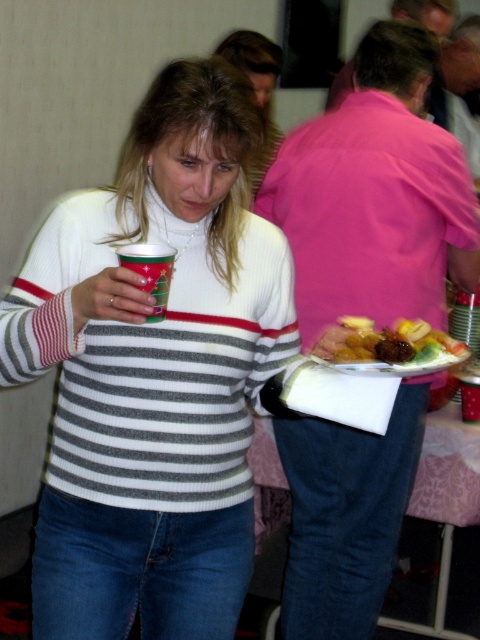
Based on the photo, you are a guest at the party and want to place your glossy plastic plate at lower center on the pink fabric table at lower center. Can you do so without needing to adjust your standing position?

The pink fabric table at lower center is much taller than the glossy plastic plate at lower center. Since the table is significantly higher, you might need to adjust your standing position to reach it comfortably.

You are at a holiday party and need to place your glossy plastic plate at lower center on the pink fabric table at lower center. Can you put it directly to the right of the plate?

Yes, since the pink fabric table at lower center is to the left of the glossy plastic plate at lower center, you can place the glossy plastic plate at lower center directly to the right of the pink fabric table at lower center.